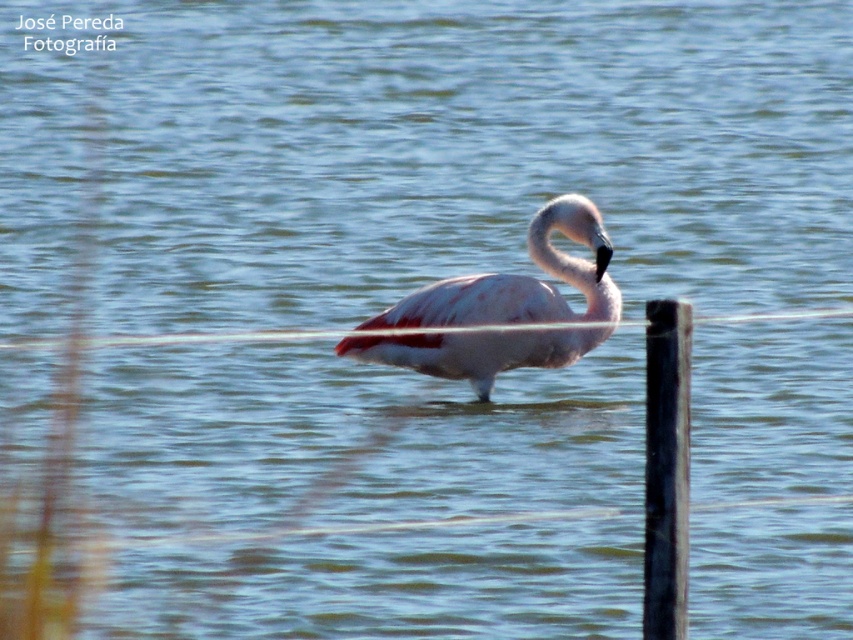
Between pink feathered flamingo at center and black smooth post at right, which one appears on the right side from the viewer's perspective?

black smooth post at right

Who is positioned more to the left, pink feathered flamingo at center or black smooth post at right?

pink feathered flamingo at center is more to the left.

Is point (553, 225) closer to viewer compared to point (689, 308)?

No, (553, 225) is further to viewer.

Where is `pink feathered flamingo at center`? pink feathered flamingo at center is located at coordinates [x=520, y=280].